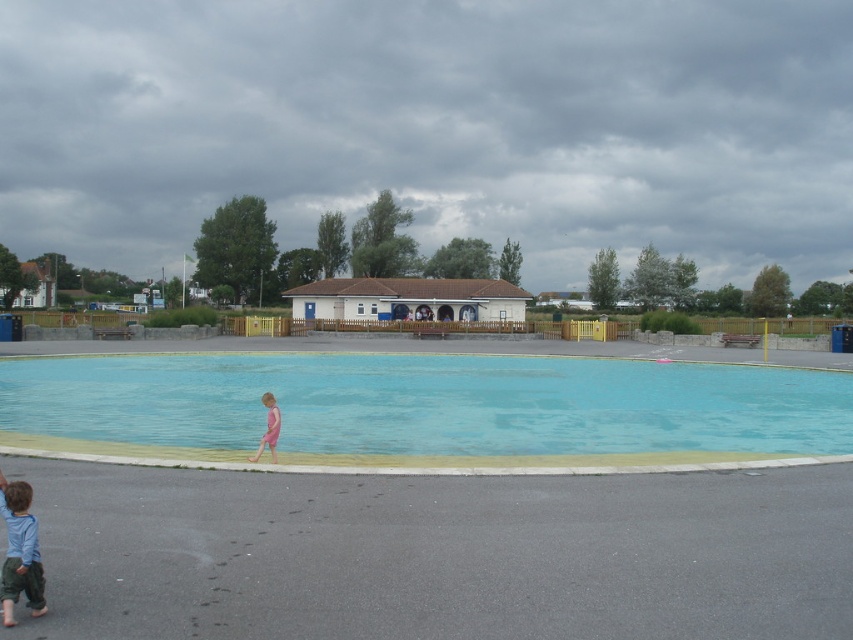
Does blue smooth water at center come in front of blue cotton shirt at lower left?

No.

Does blue smooth water at center appear under blue cotton shirt at lower left?

Yes, blue smooth water at center is below blue cotton shirt at lower left.

The height and width of the screenshot is (640, 853). In order to click on blue smooth water at center in this screenshot , I will do `click(422, 406)`.

Identify the location of blue smooth water at center. The width and height of the screenshot is (853, 640). (422, 406).

Which of these two, blue smooth water at center or pink matte swimsuit at lower center, stands taller?

Standing taller between the two is pink matte swimsuit at lower center.

Does blue smooth water at center appear on the right side of pink matte swimsuit at lower center?

Yes, blue smooth water at center is to the right of pink matte swimsuit at lower center.

Who is more forward, (1,428) or (260,452)?

Point (260,452) is in front.

This screenshot has height=640, width=853. Find the location of `blue smooth water at center`. blue smooth water at center is located at coordinates (422, 406).

Does blue cotton shirt at lower left have a lesser height compared to pink matte swimsuit at lower center?

Yes, blue cotton shirt at lower left is shorter than pink matte swimsuit at lower center.

Who is lower down, blue cotton shirt at lower left or pink matte swimsuit at lower center?

pink matte swimsuit at lower center is below.

Where is `blue cotton shirt at lower left`? blue cotton shirt at lower left is located at coordinates (19, 552).